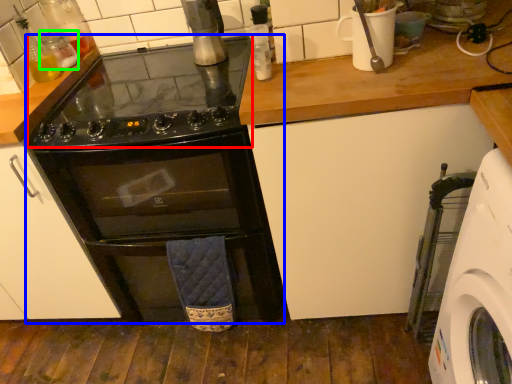
Question: Which is farther away from gas stove (highlighted by a red box)? oven (highlighted by a blue box) or bottle (highlighted by a green box)?

Choices:
 (A) oven
 (B) bottle

Answer: (B)